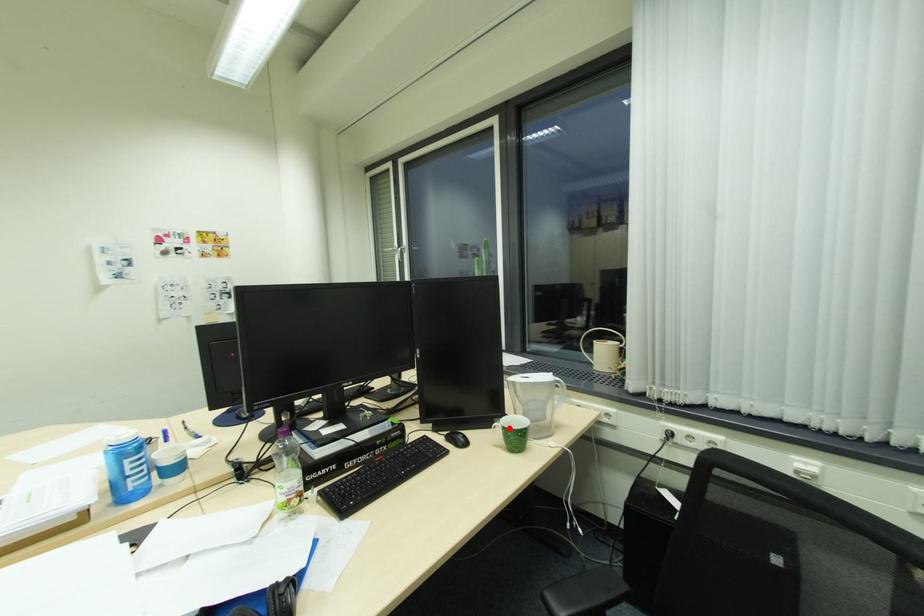
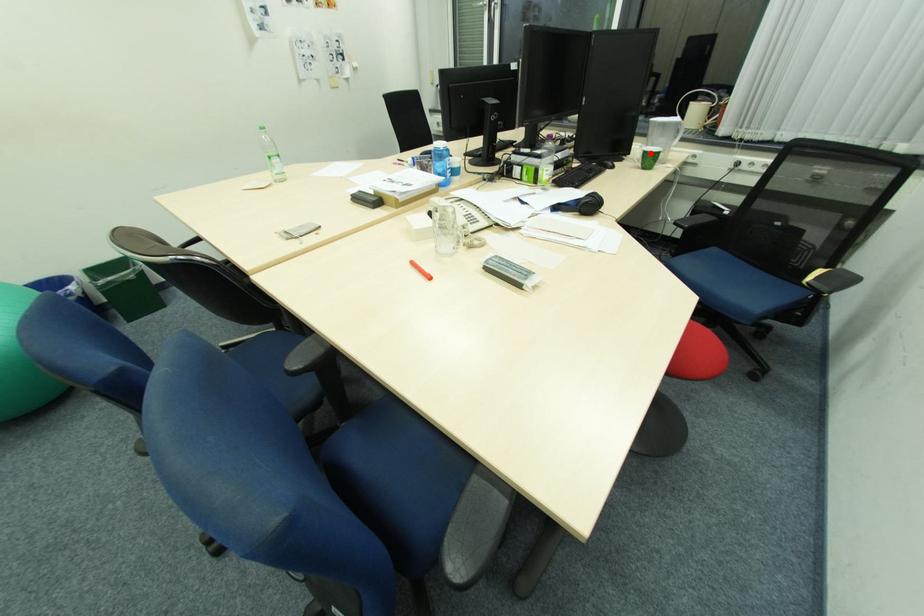
I am providing you with two images of the same scene from different viewpoints. A red point is marked on the first image and another point is marked on the second image. Is the marked point in image1 the same physical position as the marked point in image2?

Yes